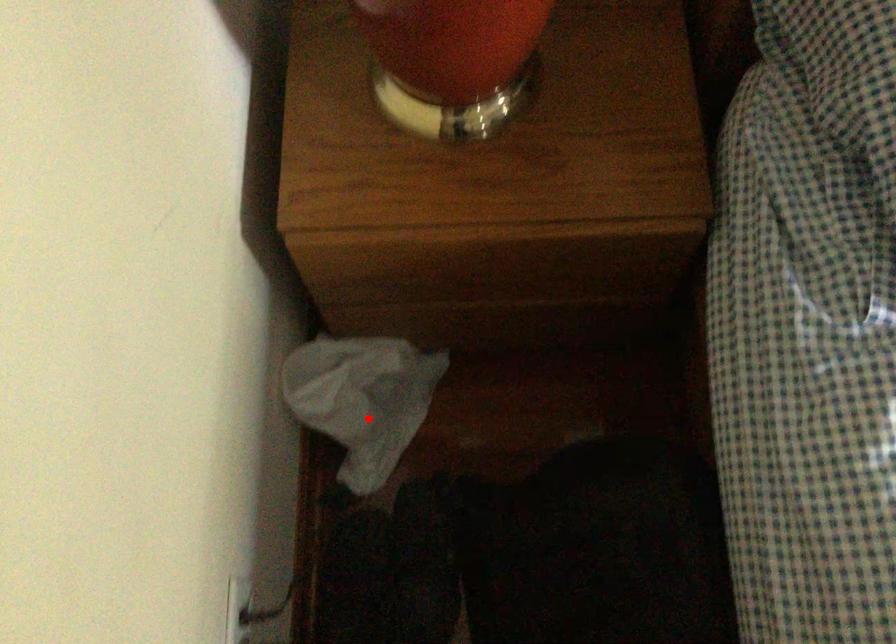
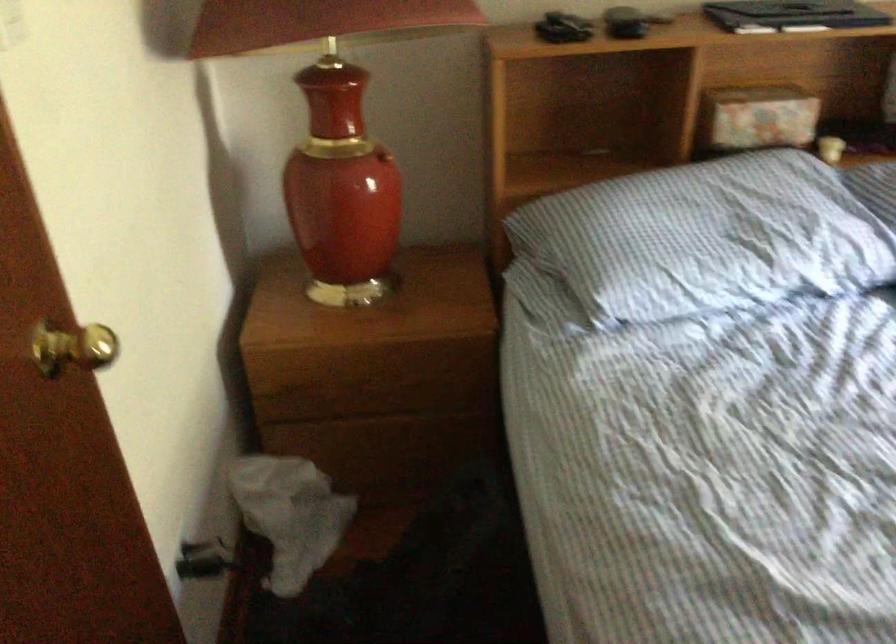
Where in the second image is the point corresponding to the highlighted location from the first image?

(289, 515)